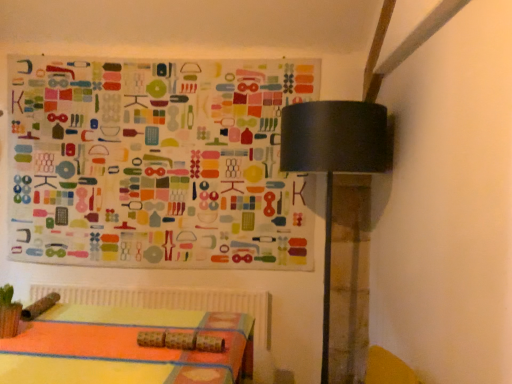
Question: Is multicolored fabric at upper left bigger than black matte table lamp at upper right?

Choices:
 (A) yes
 (B) no

Answer: (B)

Question: Is the depth of multicolored fabric at upper left less than that of black matte table lamp at upper right?

Choices:
 (A) no
 (B) yes

Answer: (A)

Question: Is there a large distance between multicolored fabric at upper left and black matte table lamp at upper right?

Choices:
 (A) yes
 (B) no

Answer: (B)

Question: Does multicolored fabric at upper left touch black matte table lamp at upper right?

Choices:
 (A) no
 (B) yes

Answer: (A)

Question: Is black matte table lamp at upper right a part of multicolored fabric at upper left?

Choices:
 (A) yes
 (B) no

Answer: (B)

Question: Does multicolored fabric at upper left have a greater width compared to black matte table lamp at upper right?

Choices:
 (A) no
 (B) yes

Answer: (A)

Question: Is black matte table lamp at upper right smaller than multicolored fabric at upper left?

Choices:
 (A) no
 (B) yes

Answer: (A)

Question: Does black matte table lamp at upper right come behind multicolored fabric at upper left?

Choices:
 (A) no
 (B) yes

Answer: (A)

Question: Can you confirm if black matte table lamp at upper right is positioned to the left of multicolored fabric at upper left?

Choices:
 (A) no
 (B) yes

Answer: (A)

Question: Does black matte table lamp at upper right turn towards multicolored fabric at upper left?

Choices:
 (A) yes
 (B) no

Answer: (B)

Question: Are black matte table lamp at upper right and multicolored fabric at upper left far apart?

Choices:
 (A) no
 (B) yes

Answer: (A)

Question: Considering the relative positions of black matte table lamp at upper right and multicolored fabric at upper left in the image provided, is black matte table lamp at upper right in front of multicolored fabric at upper left?

Choices:
 (A) yes
 (B) no

Answer: (A)

Question: Looking at their shapes, would you say multicolored fabric at upper left is wider or thinner than black matte table lamp at upper right?

Choices:
 (A) thin
 (B) wide

Answer: (A)